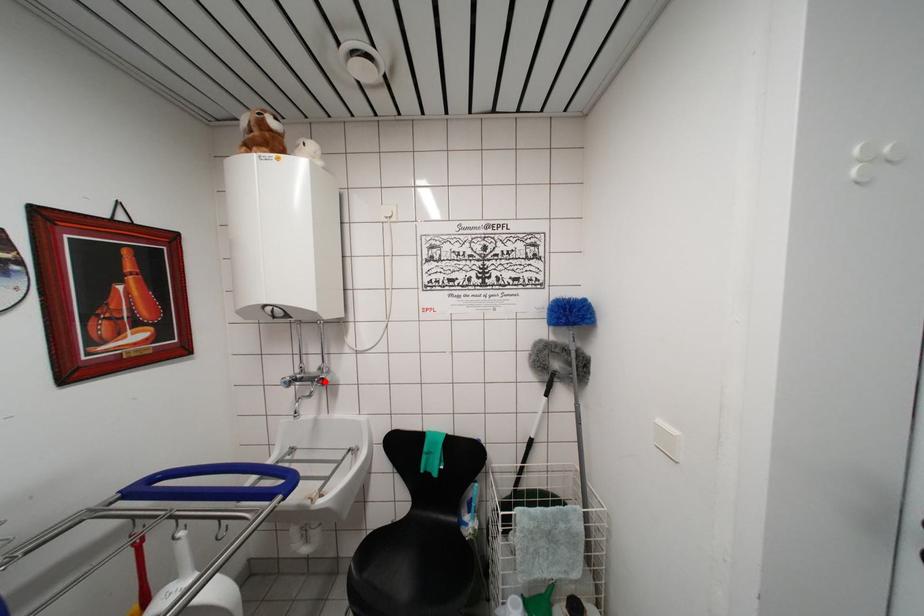
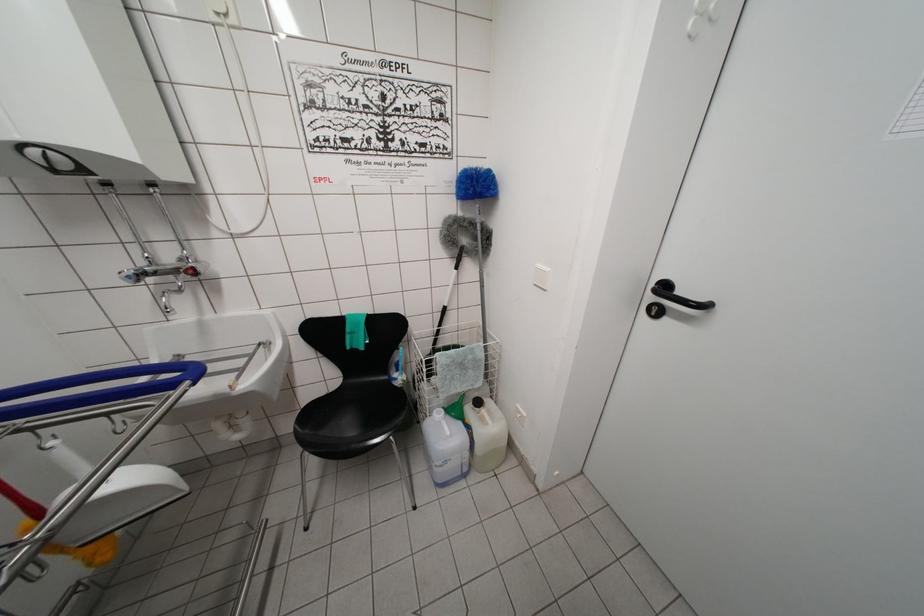
Locate, in the second image, the point that corresponds to the highlighted location in the first image.

(193, 270)